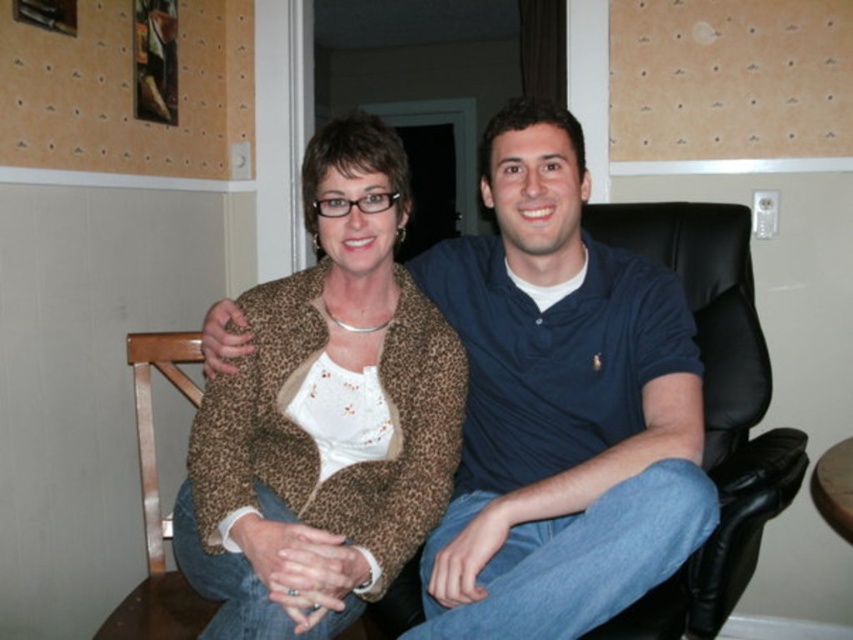
You are trying to decide which item is closer to the bottom of the image between the blue cotton polo shirt at center and the leopard print jacket at center. Which one is positioned lower?

The blue cotton polo shirt at center is located below the leopard print jacket at center, so it is positioned lower.

Consider the image. You are sitting in the black leather swivel chair at right and want to look at the brown corkboard at upper center. Can you see the corkboard without moving your head?

The brown corkboard at upper center is positioned over the black leather swivel chair at right, so you can see it directly above you without moving your head.

You are trying to decide which clothing item is taller between the blue cotton polo shirt at center and the leopard print jacket at center. Which one is taller?

The blue cotton polo shirt at center is taller than the leopard print jacket at center according to the description.